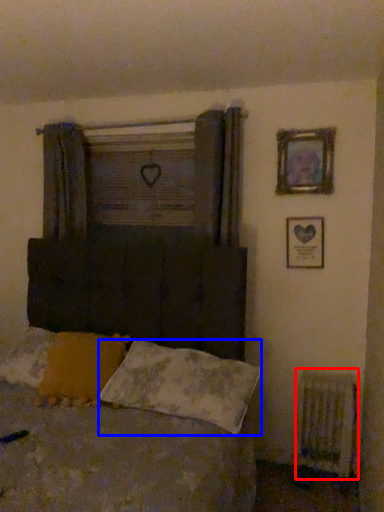
Question: Which object is further to the camera taking this photo, radiator (highlighted by a red box) or pillow (highlighted by a blue box)?

Choices:
 (A) radiator
 (B) pillow

Answer: (A)